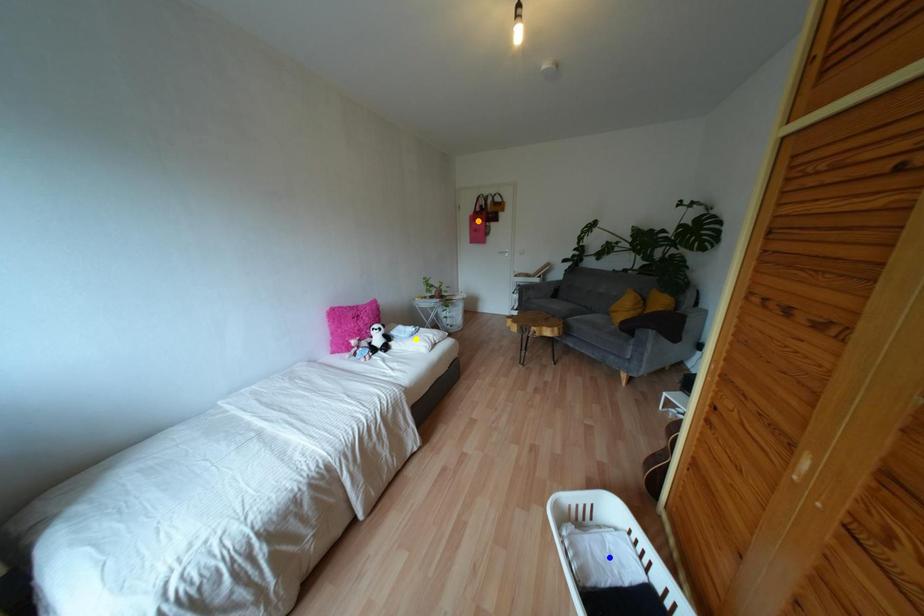
Order these from nearest to farthest:
- blue point
- yellow point
- orange point

1. orange point
2. yellow point
3. blue point